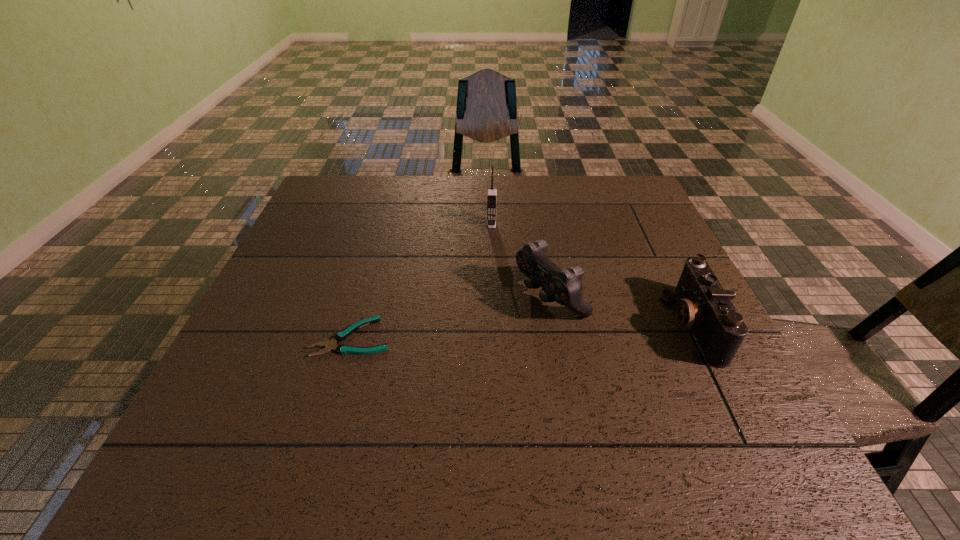
You are a GUI agent. You are given a task and a screenshot of the screen. Output one action in this format:
    pyautogui.click(x=<x>, y=<y>)
    Task: Click on the vacant space at the right edge of the desktop
    This screenshot has width=960, height=540.
    Given the screenshot: What is the action you would take?
    pyautogui.click(x=670, y=282)

The width and height of the screenshot is (960, 540). I want to click on vacant region at the near left corner, so click(x=243, y=410).

Find the location of a particular element. The image size is (960, 540). free space at the far right corner of the desktop is located at coordinates (623, 203).

This screenshot has width=960, height=540. Identify the location of vacant region at the near right corner. [x=740, y=383].

What are the coordinates of `vacant space that's between the second object from right to left and the pliers` in the screenshot? It's located at (451, 316).

You are a GUI agent. You are given a task and a screenshot of the screen. Output one action in this format:
    pyautogui.click(x=<x>, y=<y>)
    Task: Click on the vacant space that is in between the control and the pliers
    
    Given the screenshot: What is the action you would take?
    pyautogui.click(x=451, y=316)

This screenshot has width=960, height=540. In order to click on empty space between the pliers and the second object from right to left in this screenshot , I will do `click(451, 316)`.

The image size is (960, 540). Identify the location of free space between the pliers and the tallest object. (421, 281).

Locate an element on the screen. Image resolution: width=960 pixels, height=540 pixels. free spot between the third object from left to right and the shortest object is located at coordinates (451, 316).

The height and width of the screenshot is (540, 960). I want to click on free spot between the cellular telephone and the camera, so click(591, 274).